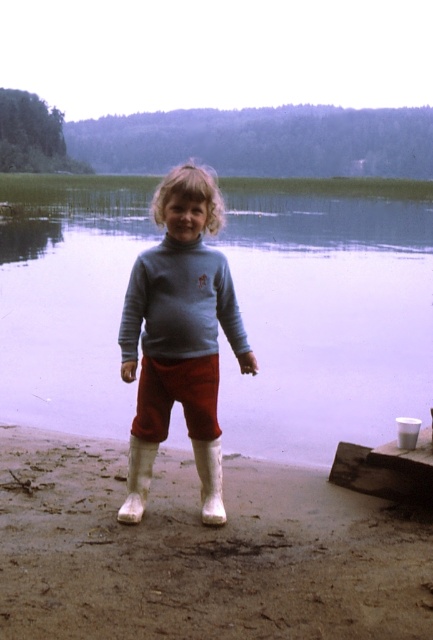
The child is standing on the brown sandy beach at lower center and wearing the matte blue sweater at center. Which object is located lower in the image?

The brown sandy beach at lower center is located lower than the matte blue sweater at center in the image.

Based on the photo, the child is wearing a matte blue sweater at center and red corduroy shorts at center. Which clothing item is closer to the observer?

The matte blue sweater at center is closer to the observer because it is in front of the red corduroy shorts at center.